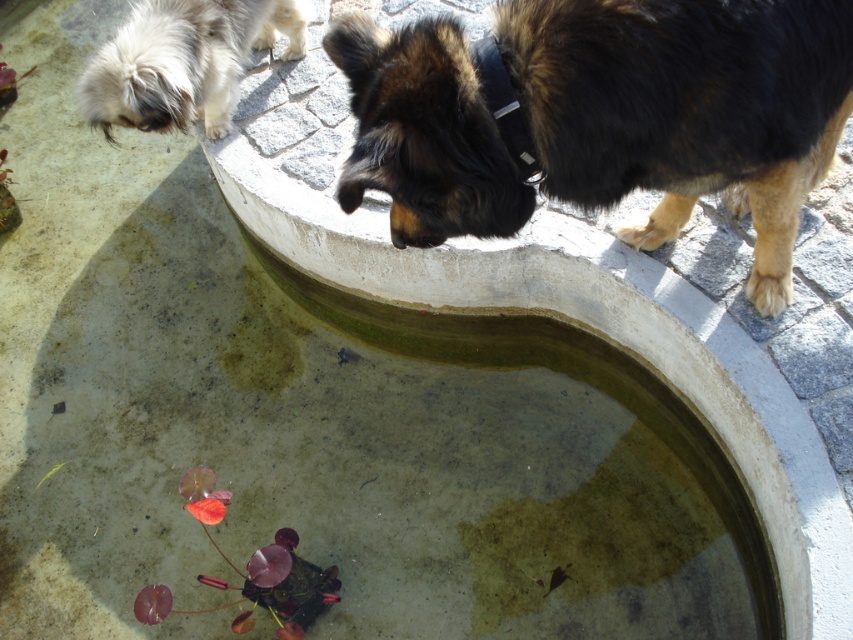
You are standing 6 feet away from the camera. Can you see the dark brown fur at upper right?

The dark brown fur at upper right is 5.99 feet away from the camera. Since you are standing 6 feet away from the camera, you are slightly farther than the distance between the camera and the dark brown fur at upper right. Therefore, you can see the dark brown fur at upper right because it is within your line of sight.

You are a photographer trying to capture a clear shot of both the dark brown fur at upper right and the white fluffy dog at upper left. Based on their positions, which dog will appear closer to the camera in the photo?

The dark brown fur at upper right will appear closer to the camera in the photo because it is positioned in front of the white fluffy dog at upper left.

You are standing in front of the fountain and want to place two markers at the coordinates point (389, 116) and point (177, 45). Which marker will be closer to your position?

Point (389, 116) is closer to the viewer than point (177, 45), so the marker at point (389, 116) will be closer to your position.